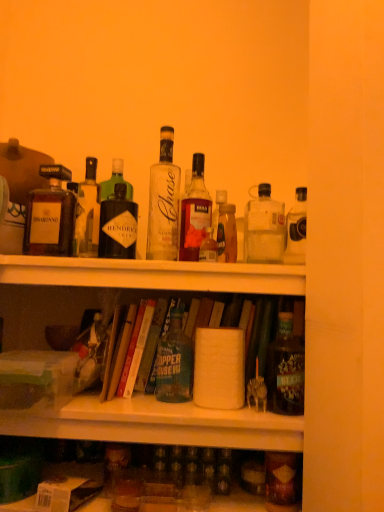
You are a GUI agent. You are given a task and a screenshot of the screen. Output one action in this format:
    pyautogui.click(x=<x>, y=<y>)
    Task: Click on the free space to the left of white matte toilet paper at center
    
    Given the screenshot: What is the action you would take?
    pyautogui.click(x=156, y=404)